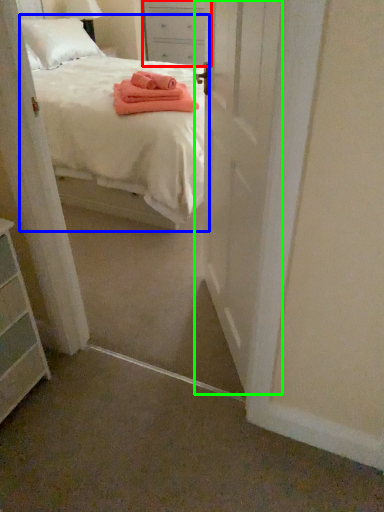
Question: Which object is the farthest from nightstand (highlighted by a red box)? Choose among these: bed (highlighted by a blue box) or door (highlighted by a green box).

Choices:
 (A) bed
 (B) door

Answer: (B)